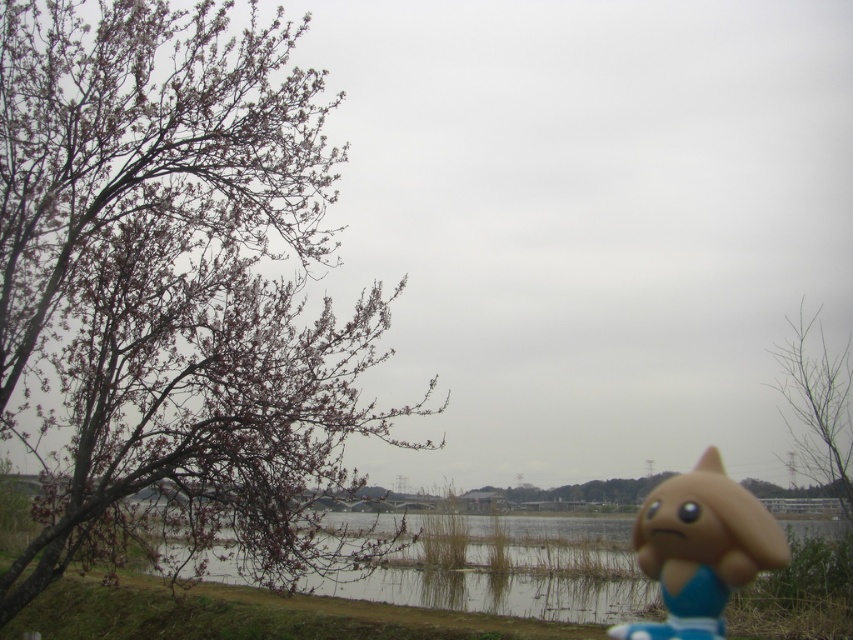
Is clear water at lake right wider than matte plastic toy at lower right?

Indeed, clear water at lake right has a greater width compared to matte plastic toy at lower right.

Is point (573, 536) positioned behind point (705, 451)?

Yes, point (573, 536) is behind point (705, 451).

Between point (581, 572) and point (770, 554), which one is positioned behind?

Point (581, 572)

You are a GUI agent. You are given a task and a screenshot of the screen. Output one action in this format:
    pyautogui.click(x=<x>, y=<y>)
    Task: Click on the clear water at lake right
    Image resolution: width=853 pixels, height=640 pixels.
    Given the screenshot: What is the action you would take?
    pyautogui.click(x=517, y=573)

Measure the distance from clear water at lake right to bare branches at upper right.

3.40 meters

Is point (476, 545) positioned behind point (846, 490)?

That is True.

Who is more forward, [531,522] or [848,349]?

Point [848,349] is more forward.

At what (x,y) coordinates should I click in order to perform the action: click on clear water at lake right. Please return your answer as a coordinate pair (x, y). The width and height of the screenshot is (853, 640). Looking at the image, I should click on (517, 573).

This screenshot has height=640, width=853. What do you see at coordinates (171, 282) in the screenshot? I see `bare branches at left` at bounding box center [171, 282].

Can you confirm if bare branches at left is shorter than clear water at lake right?

In fact, bare branches at left may be taller than clear water at lake right.

You are a GUI agent. You are given a task and a screenshot of the screen. Output one action in this format:
    pyautogui.click(x=<x>, y=<y>)
    Task: Click on the bare branches at left
    Image resolution: width=853 pixels, height=640 pixels.
    Given the screenshot: What is the action you would take?
    pyautogui.click(x=171, y=282)

This screenshot has width=853, height=640. What are the coordinates of `bare branches at left` in the screenshot? It's located at (171, 282).